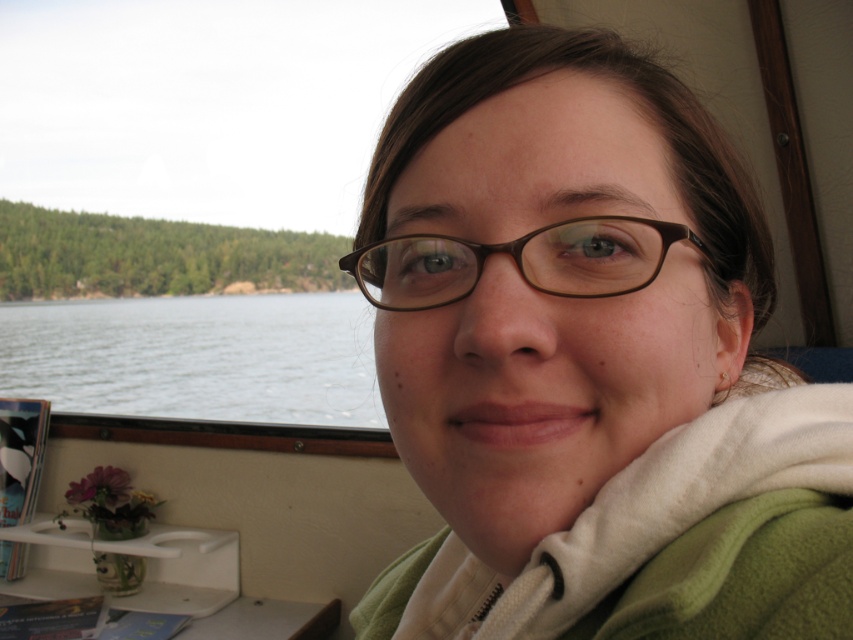
You are inside a boat and want to reach two points marked in the image. Which point is closer to you, point (601,516) or point (352,259)?

Point (601,516) is closer to the viewer than point (352,259).

You are a passenger in the boat and want to place a small toy boat in the clear water at window left without blocking the view of the brown matte glasses at center. Is the current arrangement allowing you to do that?

The clear water at window left is positioned on the left side of brown matte glasses at center, so placing a small toy boat in the clear water at window left would not block the view of the brown matte glasses at center as they are positioned to the left.